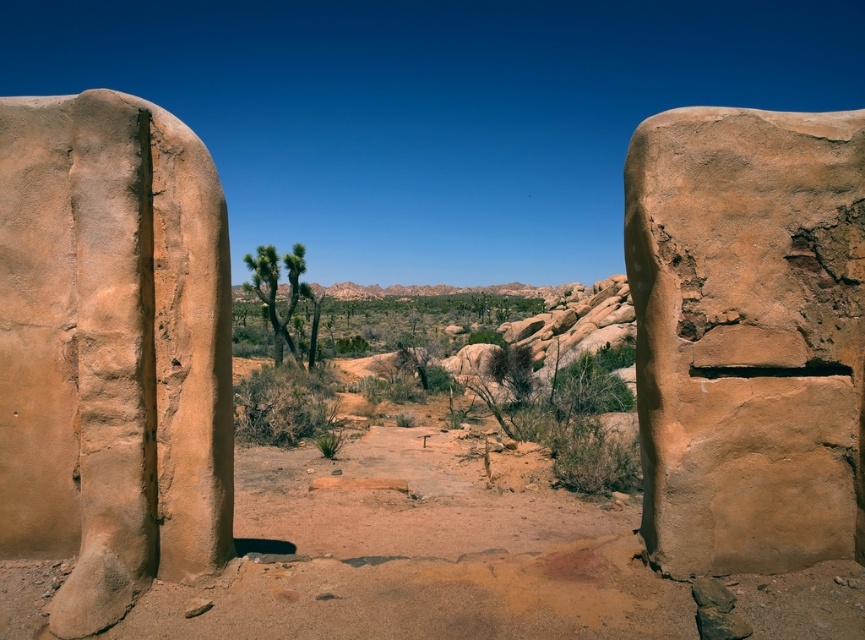
Question: Can you confirm if matte sandstone rock at left is positioned below matte sandstone boulder at right?

Choices:
 (A) yes
 (B) no

Answer: (B)

Question: Which of the following is the farthest from the observer?

Choices:
 (A) matte sandstone rock at left
 (B) matte sandstone boulder at right

Answer: (B)

Question: Is the position of matte sandstone rock at left less distant than that of matte sandstone boulder at right?

Choices:
 (A) no
 (B) yes

Answer: (B)

Question: Where is matte sandstone rock at left located in relation to matte sandstone boulder at right in the image?

Choices:
 (A) below
 (B) above

Answer: (B)

Question: Which point is closer to the camera taking this photo?

Choices:
 (A) (196, 452)
 (B) (836, 358)

Answer: (B)